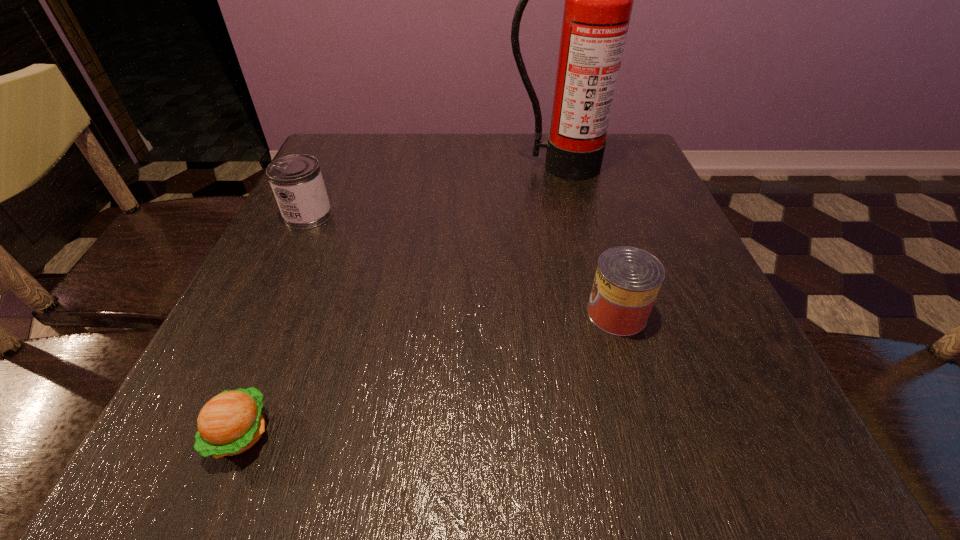
Where is `vacant area between the farthest object and the farther can`? The image size is (960, 540). vacant area between the farthest object and the farther can is located at coordinates (434, 191).

The width and height of the screenshot is (960, 540). I want to click on vacant area that lies between the second farthest object and the farthest object, so click(x=434, y=191).

I want to click on free spot between the nearest object and the fire extinguisher, so click(x=399, y=300).

Locate an element on the screen. This screenshot has width=960, height=540. unoccupied area between the fire extinguisher and the third nearest object is located at coordinates (434, 191).

This screenshot has width=960, height=540. I want to click on object that ranks as the closest to the nearest object, so click(296, 180).

Find the location of a particular element. The width and height of the screenshot is (960, 540). the second closest object relative to the nearest object is located at coordinates (627, 280).

The width and height of the screenshot is (960, 540). I want to click on free region that satisfies the following two spatial constraints: 1. on the front side of the second nearest object; 2. on the right side of the second farthest object, so click(262, 313).

I want to click on free space that satisfies the following two spatial constraints: 1. on the back side of the nearest object; 2. on the right side of the third farthest object, so pos(290,313).

Where is `free space that satisfies the following two spatial constraints: 1. on the front side of the third farthest object; 2. on the left side of the farther can`? The width and height of the screenshot is (960, 540). free space that satisfies the following two spatial constraints: 1. on the front side of the third farthest object; 2. on the left side of the farther can is located at coordinates (262, 313).

This screenshot has width=960, height=540. What are the coordinates of `free space that satisfies the following two spatial constraints: 1. on the front-facing side of the tallest object; 2. on the right side of the nearer can` in the screenshot? It's located at (595, 313).